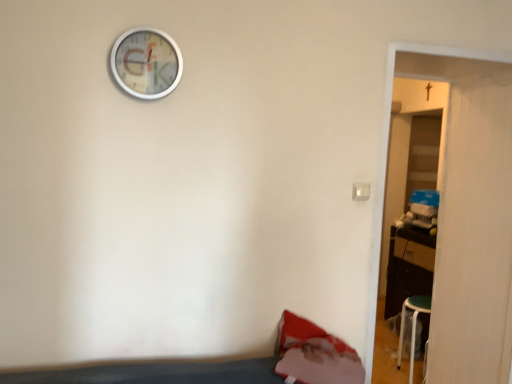
Question: Considering the positions of point (160, 71) and point (478, 122), is point (160, 71) closer or farther from the camera than point (478, 122)?

Choices:
 (A) farther
 (B) closer

Answer: (B)

Question: Considering the positions of metallic silver wall clock at upper center and wooden door at right in the image, is metallic silver wall clock at upper center taller or shorter than wooden door at right?

Choices:
 (A) short
 (B) tall

Answer: (A)

Question: From a real-world perspective, relative to wooden door at right, is metallic silver wall clock at upper center vertically above or below?

Choices:
 (A) below
 (B) above

Answer: (B)

Question: Is point (440, 261) positioned closer to the camera than point (116, 77)?

Choices:
 (A) closer
 (B) farther

Answer: (B)

Question: Do you think wooden door at right is within metallic silver wall clock at upper center, or outside of it?

Choices:
 (A) outside
 (B) inside

Answer: (A)

Question: Is wooden door at right taller or shorter than metallic silver wall clock at upper center?

Choices:
 (A) short
 (B) tall

Answer: (B)

Question: Visually, is wooden door at right positioned to the left or to the right of metallic silver wall clock at upper center?

Choices:
 (A) right
 (B) left

Answer: (A)